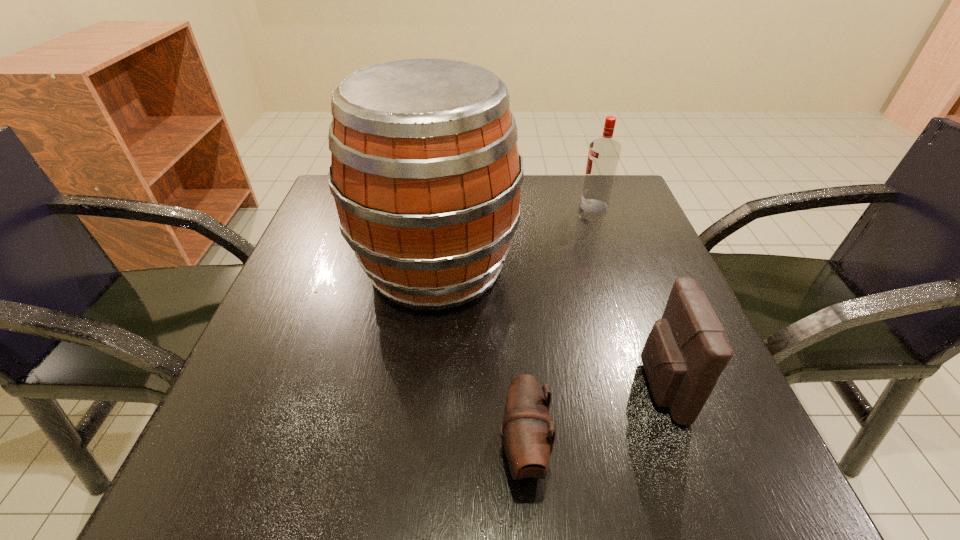
You are a GUI agent. You are given a task and a screenshot of the screen. Output one action in this format:
    pyautogui.click(x=<x>, y=<y>)
    Task: Click on the cider
    
    Given the screenshot: What is the action you would take?
    pyautogui.click(x=425, y=171)

Locate an element on the screen. This screenshot has height=540, width=960. the third nearest object is located at coordinates (425, 171).

Where is `the third shortest object`? This screenshot has width=960, height=540. the third shortest object is located at coordinates [x=603, y=156].

Where is `the farthest object`? the farthest object is located at coordinates (603, 156).

Locate an element on the screen. the taller pouch is located at coordinates (x=685, y=353).

Locate an element on the screen. Image resolution: width=960 pixels, height=540 pixels. the second shortest object is located at coordinates (685, 353).

Locate an element on the screen. Image resolution: width=960 pixels, height=540 pixels. the shorter pouch is located at coordinates (528, 441).

You are a GUI agent. You are given a task and a screenshot of the screen. Output one action in this format:
    pyautogui.click(x=<x>, y=<y>)
    Task: Click on the shortest object
    
    Given the screenshot: What is the action you would take?
    pyautogui.click(x=528, y=441)

Find the location of `vacant space located 0.160m on the front of the second farthest object`. vacant space located 0.160m on the front of the second farthest object is located at coordinates point(420,410).

The height and width of the screenshot is (540, 960). I want to click on free space located 0.220m on the front label of the third shortest object, so click(486, 206).